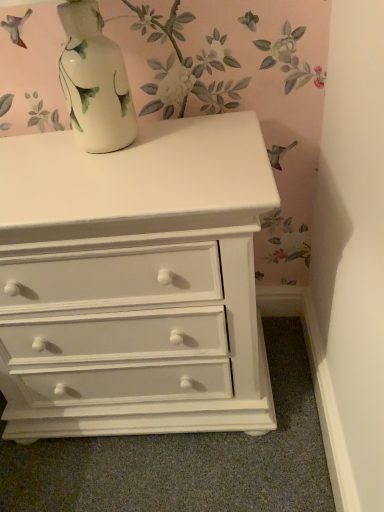
Locate an element on the screen. Image resolution: width=384 pixels, height=512 pixels. white painted wood chest of drawers at center is located at coordinates (134, 281).

The width and height of the screenshot is (384, 512). What do you see at coordinates (134, 281) in the screenshot?
I see `white painted wood chest of drawers at center` at bounding box center [134, 281].

You are a GUI agent. You are given a task and a screenshot of the screen. Output one action in this format:
    pyautogui.click(x=<x>, y=<y>)
    Task: Click on the white painted wood chest of drawers at center
    Image resolution: width=384 pixels, height=512 pixels.
    Given the screenshot: What is the action you would take?
    pos(134,281)